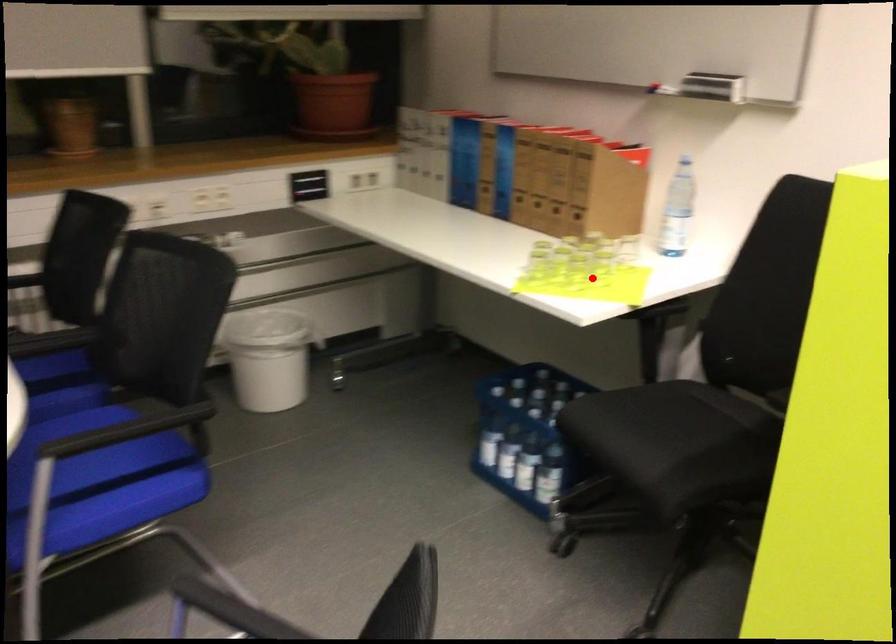
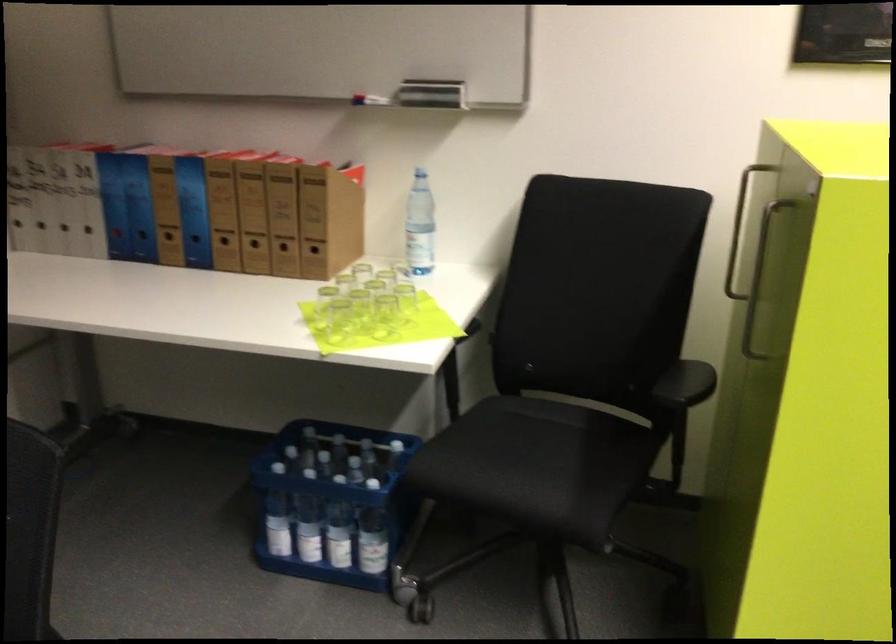
In the second image, find the point that corresponds to the highlighted location in the first image.

(383, 316)